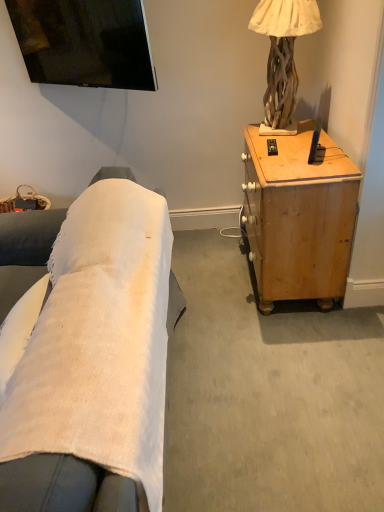
The width and height of the screenshot is (384, 512). In order to click on vacant area that lies in front of black plastic remote control at upper right in this screenshot , I will do `click(283, 161)`.